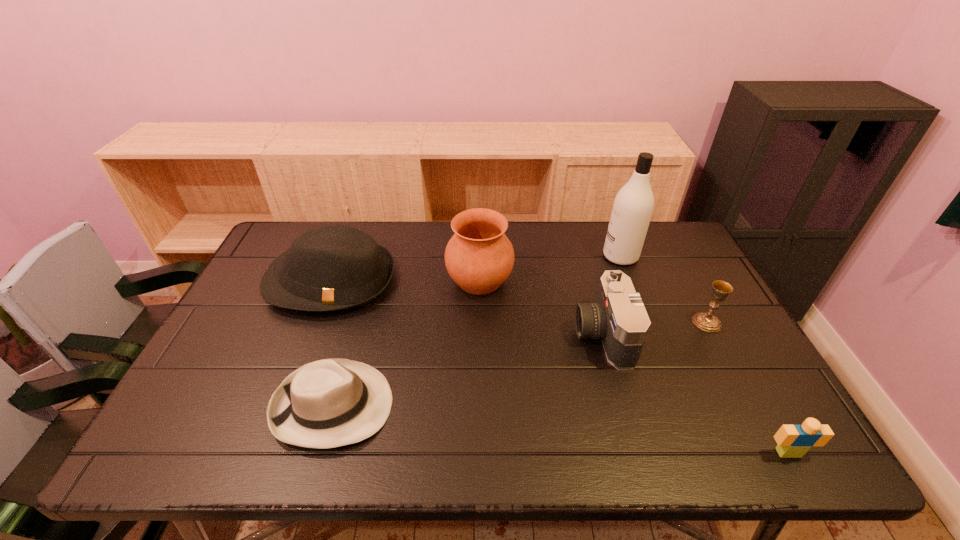
I want to click on fedora located at the far edge, so click(x=336, y=267).

Identify the location of Lego positioned at the near edge. This screenshot has height=540, width=960. (794, 441).

This screenshot has width=960, height=540. In order to click on fedora positioned at the near edge in this screenshot , I will do `click(328, 403)`.

I want to click on object that is at the left edge, so click(336, 267).

The width and height of the screenshot is (960, 540). What are the coordinates of `chalice located at the right edge` in the screenshot? It's located at (706, 321).

Locate an element on the screen. Lego that is at the right edge is located at coordinates (794, 441).

At what (x,y) coordinates should I click in order to perform the action: click on object at the far left corner. Please return your answer as a coordinate pair (x, y). The width and height of the screenshot is (960, 540). Looking at the image, I should click on tap(336, 267).

Find the location of `object situated at the near right corner`. object situated at the near right corner is located at coordinates (794, 441).

You are a GUI agent. You are given a task and a screenshot of the screen. Output one action in this format:
    pyautogui.click(x=<x>, y=<y>)
    Task: Click on the vacant space at the far edge
    
    Given the screenshot: What is the action you would take?
    pyautogui.click(x=410, y=237)

The height and width of the screenshot is (540, 960). In order to click on vacant space at the near edge of the desktop in this screenshot , I will do `click(552, 435)`.